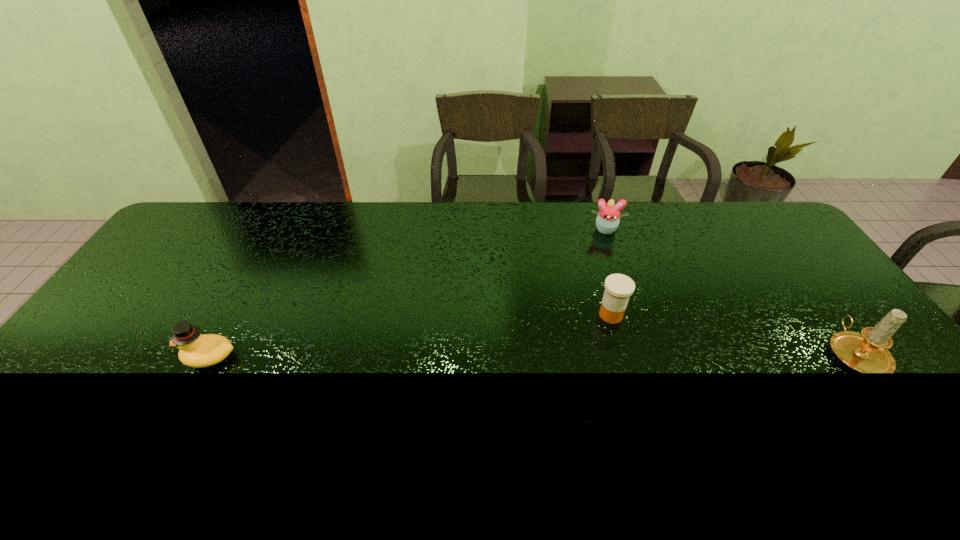
Locate an element on the screen. The image size is (960, 540). duck is located at coordinates (196, 350).

At what (x,y) coordinates should I click in order to perform the action: click on the rightmost object. Please return your answer as a coordinate pair (x, y). Looking at the image, I should click on (867, 352).

Identify the location of candle. (867, 352).

The height and width of the screenshot is (540, 960). What are the coordinates of `the third nearest object` in the screenshot? It's located at (618, 288).

At what (x,y) coordinates should I click in order to perform the action: click on cupcake. Please return your answer as a coordinate pair (x, y). This screenshot has width=960, height=540. Looking at the image, I should click on (607, 221).

Locate an element on the screen. This screenshot has height=540, width=960. free space located on the front-facing side of the leftmost object is located at coordinates (144, 357).

Where is `vacant position located 0.110m on the front-facing side of the leftmost object`? The image size is (960, 540). vacant position located 0.110m on the front-facing side of the leftmost object is located at coordinates (140, 357).

Where is `free spot located 0.290m on the front-facing side of the leftmost object`? free spot located 0.290m on the front-facing side of the leftmost object is located at coordinates 72,357.

Locate an element on the screen. The height and width of the screenshot is (540, 960). free location located on the left of the rightmost object is located at coordinates point(807,353).

Locate an element on the screen. The width and height of the screenshot is (960, 540). blank area located on the label of the second farthest object is located at coordinates (557, 357).